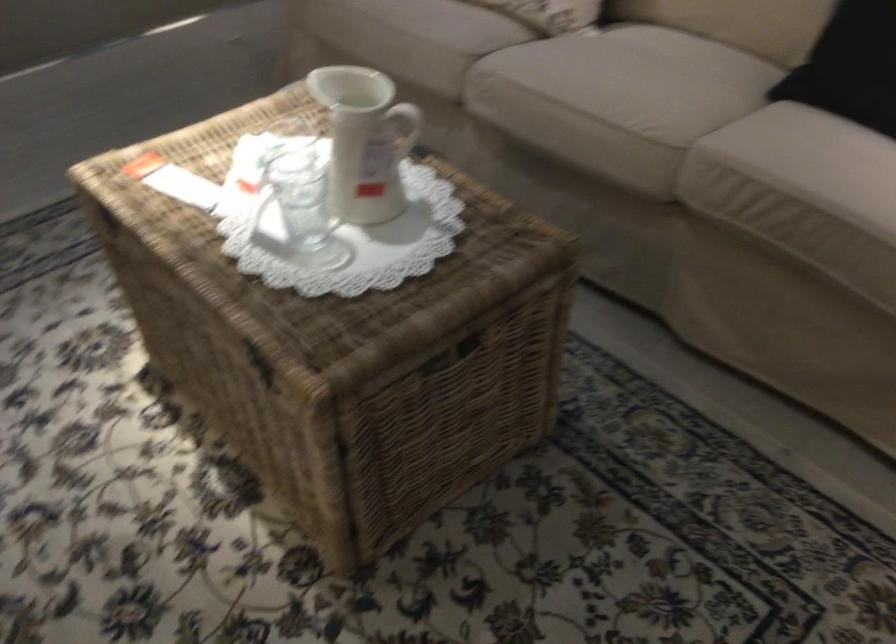
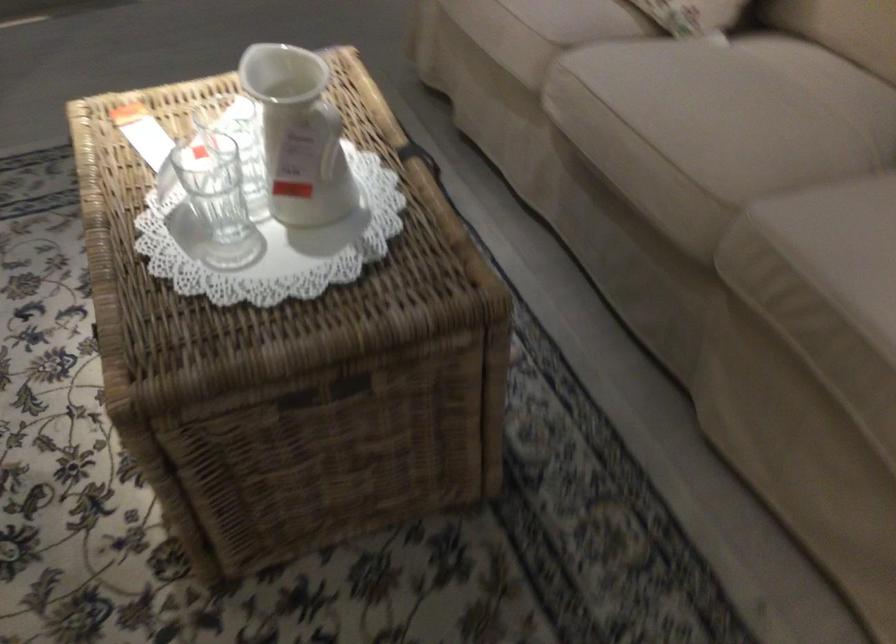
Find the pixel in the second image that matches point 648,125 in the first image.

(704, 167)